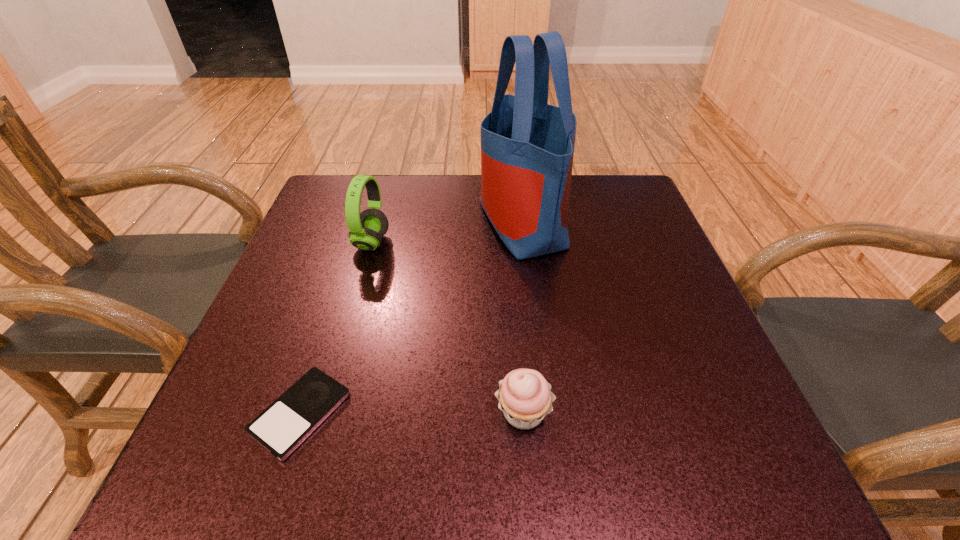
This screenshot has height=540, width=960. Identify the location of cupcake present at the near edge. (525, 397).

Find the location of a particular element. The height and width of the screenshot is (540, 960). iPod that is at the near edge is located at coordinates (291, 418).

The image size is (960, 540). I want to click on headset positioned at the left edge, so 366,229.

This screenshot has height=540, width=960. In order to click on iPod that is at the left edge in this screenshot , I will do `click(291, 418)`.

Locate an element on the screen. Image resolution: width=960 pixels, height=540 pixels. object that is at the far left corner is located at coordinates (366, 229).

The height and width of the screenshot is (540, 960). Find the location of `object located in the near left corner section of the desktop`. object located in the near left corner section of the desktop is located at coordinates (291, 418).

In the image, there is a desktop. In order to click on free space at the far edge in this screenshot , I will do pyautogui.click(x=575, y=217).

Locate an element on the screen. vacant region at the near edge is located at coordinates (311, 482).

Find the location of a particular element. blank space at the left edge is located at coordinates [x=327, y=230].

I want to click on vacant space at the right edge of the desktop, so 637,234.